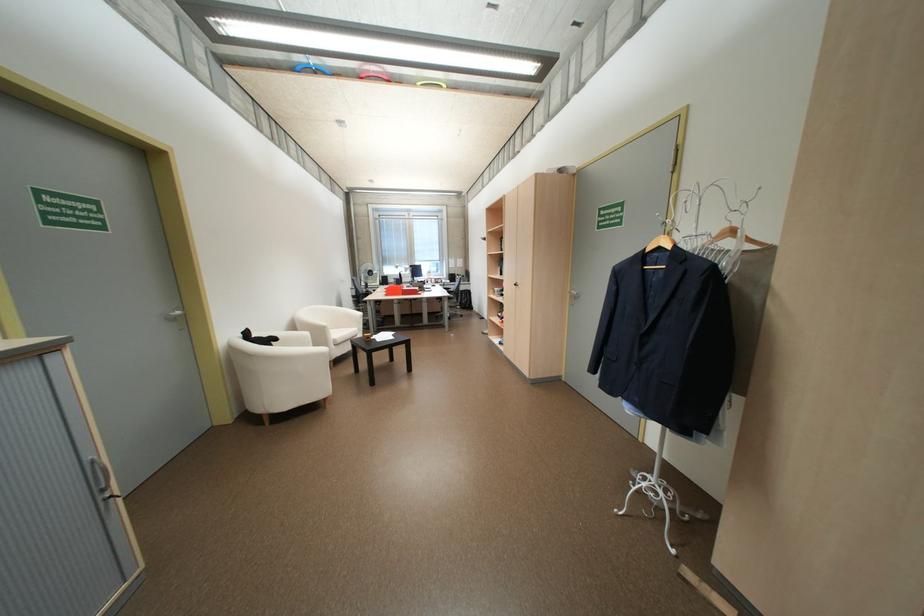
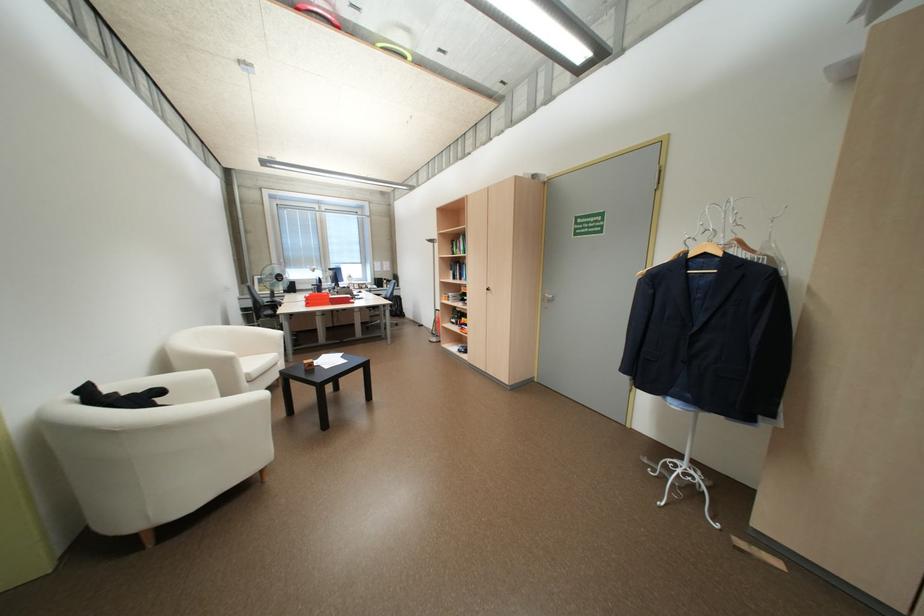
The point at (x=507, y=275) is marked in the first image. Where is the corresponding point in the second image?

(460, 280)